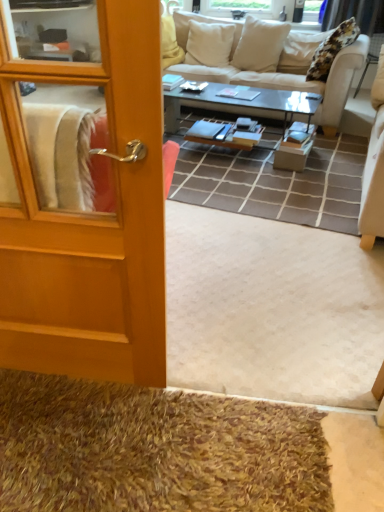
Question: From the image's perspective, is wooden door at left positioned above or below black glass coffee table at center?

Choices:
 (A) above
 (B) below

Answer: (B)

Question: In terms of width, does wooden door at left look wider or thinner when compared to black glass coffee table at center?

Choices:
 (A) wide
 (B) thin

Answer: (B)

Question: Estimate the real-world distances between objects in this image. Which object is farther from the wooden door at left?

Choices:
 (A) black glass coffee table at center
 (B) beige fabric couch at upper center
 (C) shaggy brown doormat at lower left

Answer: (B)

Question: Estimate the real-world distances between objects in this image. Which object is closer to the wooden door at left?

Choices:
 (A) shaggy brown doormat at lower left
 (B) black glass coffee table at center
 (C) beige fabric couch at upper center

Answer: (A)